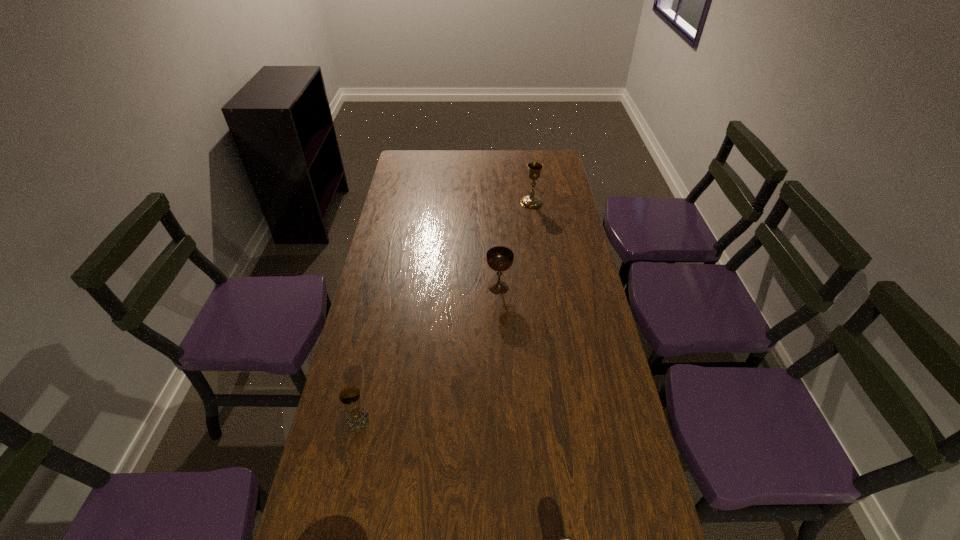
Where is `the farthest object`? The height and width of the screenshot is (540, 960). the farthest object is located at coordinates [x=529, y=201].

Image resolution: width=960 pixels, height=540 pixels. Find the location of `the farthest chalice`. the farthest chalice is located at coordinates (529, 201).

This screenshot has width=960, height=540. In order to click on the second chalice from right to left in this screenshot , I will do `click(499, 258)`.

This screenshot has width=960, height=540. In order to click on the second shortest chalice in this screenshot , I will do `click(499, 258)`.

Find the location of `the leftmost object`. the leftmost object is located at coordinates pyautogui.click(x=350, y=396).

Where is `the leftmost chalice`? This screenshot has height=540, width=960. the leftmost chalice is located at coordinates (350, 396).

Locate an element on the screen. free region located on the front of the farthest object is located at coordinates (541, 273).

In order to click on free location located on the right of the second shortest chalice in this screenshot , I will do `click(546, 288)`.

Locate an element on the screen. free space located on the right of the third farthest object is located at coordinates (493, 420).

At what (x,y) coordinates should I click in order to perform the action: click on object located at the left edge. Please return your answer as a coordinate pair (x, y). Looking at the image, I should click on (350, 396).